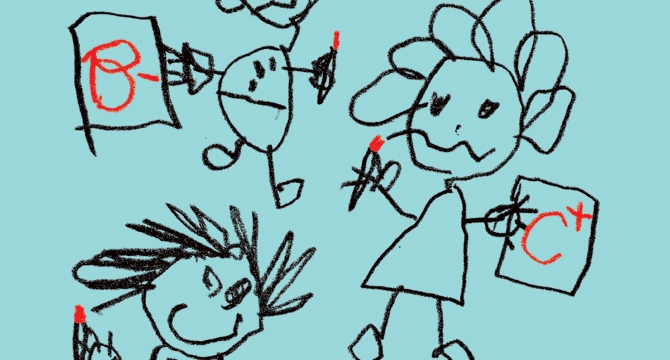
Where is `marker with red tip`? The width and height of the screenshot is (670, 360). marker with red tip is located at coordinates (373, 141), (331, 63), (74, 336).